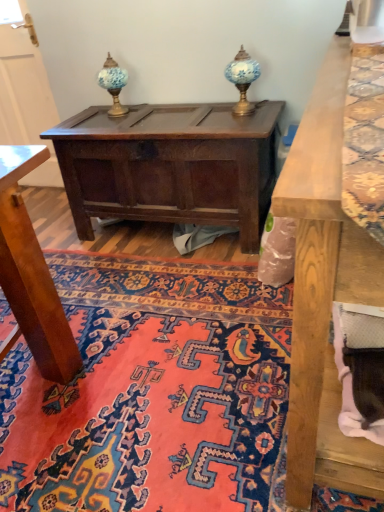
Image resolution: width=384 pixels, height=512 pixels. What do you see at coordinates (242, 79) in the screenshot? I see `blue glass table lamp at upper center, the second table lamp from the left` at bounding box center [242, 79].

Identify the location of blue glass table lamp at upper center, the second table lamp from the left. The image size is (384, 512). (242, 79).

Find the location of `blue glass table lamp at upper center, arranged as the 2th table lamp when viewed from the right`. blue glass table lamp at upper center, arranged as the 2th table lamp when viewed from the right is located at coordinates (113, 85).

The height and width of the screenshot is (512, 384). What are the coordinates of `blue glass table lamp at upper center, positioned as the 1th table lamp in right-to-left order` in the screenshot? It's located at (242, 79).

Is dark brown wood chest at center positioned in front of carpet with intricate patterns at center?

No, it is not.

Is dark brown wood chest at center at the left side of carpet with intricate patterns at center?

Correct, you'll find dark brown wood chest at center to the left of carpet with intricate patterns at center.

Considering the relative sizes of dark brown wood chest at center and carpet with intricate patterns at center in the image provided, is dark brown wood chest at center taller than carpet with intricate patterns at center?

Yes.

Between blue glass table lamp at upper center, arranged as the 2th table lamp when viewed from the right, and carpet with intricate patterns at center, which one has smaller size?

blue glass table lamp at upper center, arranged as the 2th table lamp when viewed from the right, is smaller.

Looking at this image, is blue glass table lamp at upper center, arranged as the 2th table lamp when viewed from the right, outside of carpet with intricate patterns at center?

blue glass table lamp at upper center, arranged as the 2th table lamp when viewed from the right, is positioned outside carpet with intricate patterns at center.

From the image's perspective, which is below, blue glass table lamp at upper center, arranged as the 2th table lamp when viewed from the right, or carpet with intricate patterns at center?

carpet with intricate patterns at center, from the image's perspective.

Can you tell me how much blue glass table lamp at upper center, which is counted as the 1th table lamp, starting from the left, and carpet with intricate patterns at center differ in facing direction?

There is a 91.7-degree angle between the facing directions of blue glass table lamp at upper center, which is counted as the 1th table lamp, starting from the left, and carpet with intricate patterns at center.

Is carpet with intricate patterns at center in front of blue glass table lamp at upper center, positioned as the 1th table lamp in right-to-left order?

Yes, it is.

From the picture: Which is less distant, (232, 290) or (238, 67)?

Point (232, 290)

From a real-world perspective, which object rests below the other?

In real-world perspective, carpet with intricate patterns at center is lower.

Is carpet with intricate patterns at center positioned far away from blue glass table lamp at upper center, the second table lamp from the left?

Yes.

Who is taller, blue glass table lamp at upper center, arranged as the 2th table lamp when viewed from the right, or dark brown wood chest at center?

With more height is dark brown wood chest at center.

Does blue glass table lamp at upper center, arranged as the 2th table lamp when viewed from the right, lie behind dark brown wood chest at center?

Yes, it is behind dark brown wood chest at center.

Are blue glass table lamp at upper center, which is counted as the 1th table lamp, starting from the left, and dark brown wood chest at center located far from each other?

They are positioned close to each other.

Is blue glass table lamp at upper center, which is counted as the 1th table lamp, starting from the left, facing away from dark brown wood chest at center?

No, blue glass table lamp at upper center, which is counted as the 1th table lamp, starting from the left, is not facing the opposite direction of dark brown wood chest at center.

Is blue glass table lamp at upper center, positioned as the 1th table lamp in right-to-left order, to the right of carpet with intricate patterns at center from the viewer's perspective?

Yes, blue glass table lamp at upper center, positioned as the 1th table lamp in right-to-left order, is to the right of carpet with intricate patterns at center.

Is blue glass table lamp at upper center, positioned as the 1th table lamp in right-to-left order, turned away from carpet with intricate patterns at center?

No, blue glass table lamp at upper center, positioned as the 1th table lamp in right-to-left order, is not facing the opposite direction of carpet with intricate patterns at center.

I want to click on mat below the blue glass table lamp at upper center, the second table lamp from the left (from the image's perspective), so click(x=153, y=393).

From a real-world perspective, is blue glass table lamp at upper center, positioned as the 1th table lamp in right-to-left order, physically above carpet with intricate patterns at center?

Yes, from a real-world perspective, blue glass table lamp at upper center, positioned as the 1th table lamp in right-to-left order, is on top of carpet with intricate patterns at center.

How many degrees apart are the facing directions of blue glass table lamp at upper center, arranged as the 2th table lamp when viewed from the right, and blue glass table lamp at upper center, the second table lamp from the left?

A: They differ by 0.00101 degrees in their facing directions.

Is blue glass table lamp at upper center, arranged as the 2th table lamp when viewed from the right, to the left of blue glass table lamp at upper center, positioned as the 1th table lamp in right-to-left order, from the viewer's perspective?

Indeed, blue glass table lamp at upper center, arranged as the 2th table lamp when viewed from the right, is positioned on the left side of blue glass table lamp at upper center, positioned as the 1th table lamp in right-to-left order.

In the scene shown: Considering the relative sizes of blue glass table lamp at upper center, which is counted as the 1th table lamp, starting from the left, and blue glass table lamp at upper center, the second table lamp from the left, in the image provided, is blue glass table lamp at upper center, which is counted as the 1th table lamp, starting from the left, taller than blue glass table lamp at upper center, the second table lamp from the left,?

Indeed, blue glass table lamp at upper center, which is counted as the 1th table lamp, starting from the left, has a greater height compared to blue glass table lamp at upper center, the second table lamp from the left.

Measure the distance between blue glass table lamp at upper center, arranged as the 2th table lamp when viewed from the right, and blue glass table lamp at upper center, positioned as the 1th table lamp in right-to-left order.

blue glass table lamp at upper center, arranged as the 2th table lamp when viewed from the right, is 23.52 inches away from blue glass table lamp at upper center, positioned as the 1th table lamp in right-to-left order.

Is dark brown wood chest at center positioned before blue glass table lamp at upper center, arranged as the 2th table lamp when viewed from the right?

Yes, dark brown wood chest at center is closer to the camera.

Consider the image. From the image's perspective, is dark brown wood chest at center positioned above or below blue glass table lamp at upper center, which is counted as the 1th table lamp, starting from the left?

Based on their image positions, dark brown wood chest at center is located beneath blue glass table lamp at upper center, which is counted as the 1th table lamp, starting from the left.

Is dark brown wood chest at center wider or thinner than blue glass table lamp at upper center, arranged as the 2th table lamp when viewed from the right?

Considering their sizes, dark brown wood chest at center looks broader than blue glass table lamp at upper center, arranged as the 2th table lamp when viewed from the right.

Locate an element on the screen. table on the left of the carpet with intricate patterns at center is located at coordinates (170, 166).

Where is `the 2nd table lamp behind the carpet with intricate patterns at center, counting from the anchor's position`? The image size is (384, 512). the 2nd table lamp behind the carpet with intricate patterns at center, counting from the anchor's position is located at coordinates (113, 85).

When comparing their distances from blue glass table lamp at upper center, arranged as the 2th table lamp when viewed from the right, does dark brown wood chest at center or blue glass table lamp at upper center, positioned as the 1th table lamp in right-to-left order, seem further?

The object further to blue glass table lamp at upper center, arranged as the 2th table lamp when viewed from the right, is blue glass table lamp at upper center, positioned as the 1th table lamp in right-to-left order.

Which object lies further to the anchor point carpet with intricate patterns at center, blue glass table lamp at upper center, positioned as the 1th table lamp in right-to-left order, or dark brown wood chest at center?

blue glass table lamp at upper center, positioned as the 1th table lamp in right-to-left order, is further to carpet with intricate patterns at center.

From the image, which object appears to be nearer to blue glass table lamp at upper center, arranged as the 2th table lamp when viewed from the right, carpet with intricate patterns at center or blue glass table lamp at upper center, the second table lamp from the left?

The object closer to blue glass table lamp at upper center, arranged as the 2th table lamp when viewed from the right, is blue glass table lamp at upper center, the second table lamp from the left.

Looking at the image, which one is located closer to dark brown wood chest at center, carpet with intricate patterns at center or blue glass table lamp at upper center, positioned as the 1th table lamp in right-to-left order?

The object closer to dark brown wood chest at center is blue glass table lamp at upper center, positioned as the 1th table lamp in right-to-left order.

From the image, which object appears to be farther from blue glass table lamp at upper center, positioned as the 1th table lamp in right-to-left order, blue glass table lamp at upper center, which is counted as the 1th table lamp, starting from the left, or dark brown wood chest at center?

blue glass table lamp at upper center, which is counted as the 1th table lamp, starting from the left, lies further to blue glass table lamp at upper center, positioned as the 1th table lamp in right-to-left order, than the other object.

Which object lies further to the anchor point carpet with intricate patterns at center, blue glass table lamp at upper center, positioned as the 1th table lamp in right-to-left order, or blue glass table lamp at upper center, which is counted as the 1th table lamp, starting from the left?

Among the two, blue glass table lamp at upper center, which is counted as the 1th table lamp, starting from the left, is located further to carpet with intricate patterns at center.

When comparing their distances from carpet with intricate patterns at center, does dark brown wood chest at center or blue glass table lamp at upper center, which is counted as the 1th table lamp, starting from the left, seem closer?

dark brown wood chest at center is closer to carpet with intricate patterns at center.

Considering their positions, is blue glass table lamp at upper center, arranged as the 2th table lamp when viewed from the right, positioned closer to dark brown wood chest at center than carpet with intricate patterns at center?

blue glass table lamp at upper center, arranged as the 2th table lamp when viewed from the right, lies closer to dark brown wood chest at center than the other object.

I want to click on table situated between blue glass table lamp at upper center, which is counted as the 1th table lamp, starting from the left, and blue glass table lamp at upper center, the second table lamp from the left, from left to right, so click(170, 166).

This screenshot has height=512, width=384. What are the coordinates of `table that lies between blue glass table lamp at upper center, positioned as the 1th table lamp in right-to-left order, and carpet with intricate patterns at center from top to bottom` in the screenshot? It's located at (170, 166).

Find the location of a particular element. table lamp between blue glass table lamp at upper center, arranged as the 2th table lamp when viewed from the right, and carpet with intricate patterns at center vertically is located at coordinates (242, 79).

Locate an element on the screen. table between carpet with intricate patterns at center and blue glass table lamp at upper center, which is counted as the 1th table lamp, starting from the left, from front to back is located at coordinates (170, 166).